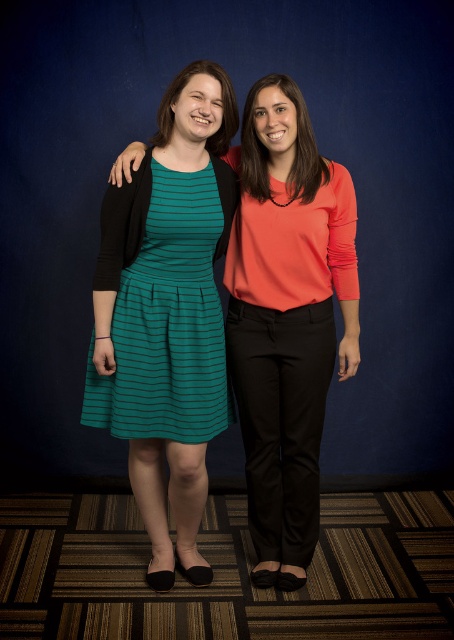
You are a photographer setting up for a photoshoot. You have two outfits to feature in the image. The teal striped dress at center and the matte orange blouse at center. Based on the scene description, which outfit would you recommend placing closer to the camera to ensure it stands out more, considering their sizes?

The teal striped dress at center is larger in size than the matte orange blouse at center. To make it stand out more, place the teal striped dress at center closer to the camera since its larger size will naturally draw more attention.

You are a photographer setting up for a professional photoshoot. You need to ensure that both the matte coral blouse at center and the teal striped dress at center are clearly visible in the frame. Given their height difference, which clothing item will appear larger in the photo?

The matte coral blouse at center is much taller than the teal striped dress at center, so it will appear larger in the photo.

You are organizing a clothing display and need to arrange the matte coral blouse at center and the matte orange blouse at center according to their positions. Which blouse should be placed to the left of the other?

The matte coral blouse at center should be placed to the right of the matte orange blouse at center because the matte coral blouse at center is positioned on the right side of matte orange blouse at center.